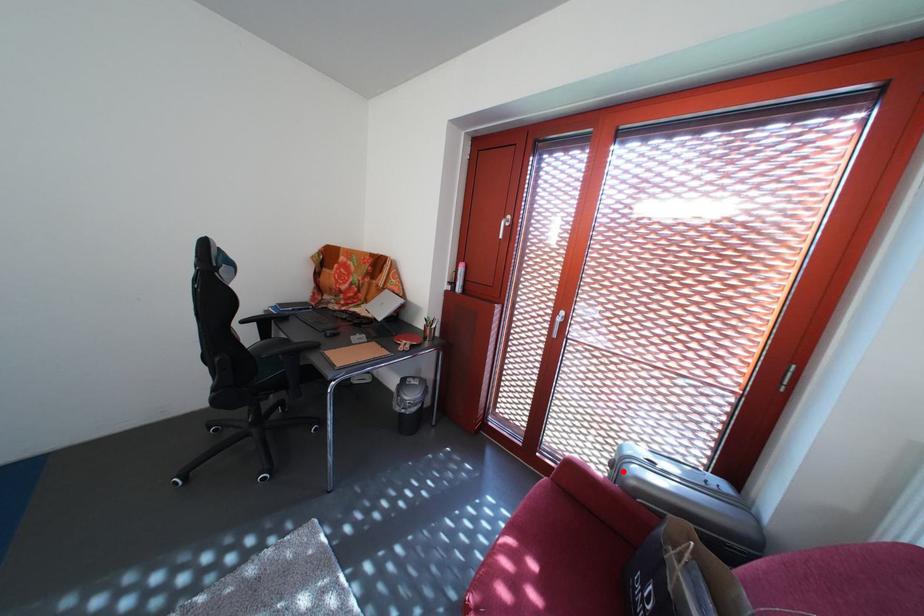
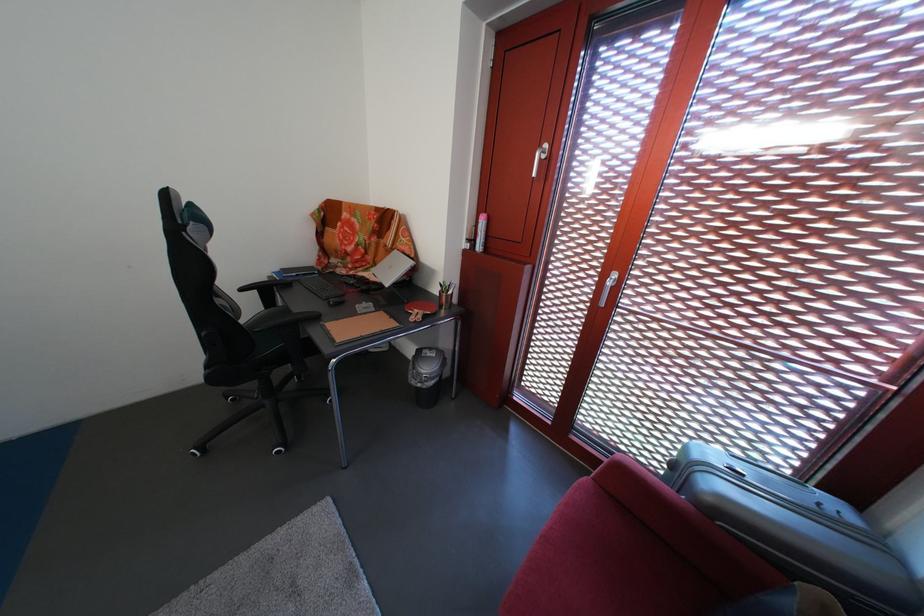
Question: I am providing you with two images of the same scene from different viewpoints. In image1, a red point is highlighted. Considering the same 3D point in image2, which of the following is correct?

Choices:
 (A) It is closer
 (B) It is farther

Answer: (A)